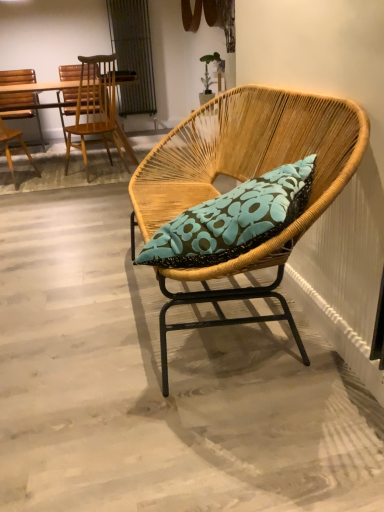
Question: Relative to brown wooden desk at left, is woven wood chair at center, the 1th chair viewed from the right, in front or behind?

Choices:
 (A) behind
 (B) front

Answer: (B)

Question: Is point coord(216,141) closer or farther from the camera than point coord(127,77)?

Choices:
 (A) closer
 (B) farther

Answer: (A)

Question: Estimate the real-world distances between objects in this image. Which object is farther from the wooden chair at left, which appears as the third chair when viewed from the right?

Choices:
 (A) woven wood chair at center, the 1th chair viewed from the right
 (B) wooden chair at upper left, which is counted as the second chair, starting from the right
 (C) brown wooden desk at left

Answer: (A)

Question: Which object is positioned farthest from the brown wooden desk at left?

Choices:
 (A) wooden chair at upper left, which is counted as the 2th chair, starting from the left
 (B) wooden chair at left, arranged as the first chair when viewed from the left
 (C) woven wood chair at center, the 3th chair in the back-to-front sequence

Answer: (C)